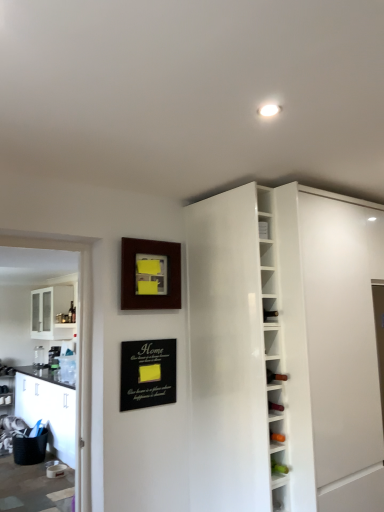
Locate an element on the screen. green matte bottle at lower right is located at coordinates (278, 467).

Measure the distance between point (132, 283) and camera.

A distance of 7.51 feet exists between point (132, 283) and camera.

The width and height of the screenshot is (384, 512). What do you see at coordinates (284, 349) in the screenshot? I see `white glossy cabinet at upper right` at bounding box center [284, 349].

Where is `green matte bottle at lower right`? Image resolution: width=384 pixels, height=512 pixels. green matte bottle at lower right is located at coordinates (278, 467).

Is green matte bottle at lower right to the right of black matte bulletin board at lower center from the viewer's perspective?

Yes.

Considering the positions of objects green matte bottle at lower right and black matte bulletin board at lower center in the image provided, who is behind, green matte bottle at lower right or black matte bulletin board at lower center?

black matte bulletin board at lower center is behind.

How much distance is there between green matte bottle at lower right and black matte bulletin board at lower center?

The distance of green matte bottle at lower right from black matte bulletin board at lower center is 29.48 inches.

Considering the relative sizes of green matte bottle at lower right and black matte bulletin board at lower center in the image provided, is green matte bottle at lower right wider than black matte bulletin board at lower center?

Indeed, green matte bottle at lower right has a greater width compared to black matte bulletin board at lower center.

Does black matte bulletin board at lower center lie in front of white glossy cabinet at upper right?

No.

Which object is positioned more to the right, black matte bulletin board at lower center or white glossy cabinet at upper right?

white glossy cabinet at upper right.

Based on the photo, in terms of size, does black matte bulletin board at lower center appear bigger or smaller than white glossy cabinet at upper right?

Clearly, black matte bulletin board at lower center is smaller in size than white glossy cabinet at upper right.

From the image's perspective, is black matte bulletin board at lower center positioned above or below white glossy cabinet at upper right?

Based on their image positions, black matte bulletin board at lower center is located above white glossy cabinet at upper right.

In the image, is black matte bulletin board at lower center positioned in front of or behind green matte bottle at lower right?

Clearly, black matte bulletin board at lower center is behind green matte bottle at lower right.

Is black matte bulletin board at lower center completely or partially outside of green matte bottle at lower right?

black matte bulletin board at lower center is positioned outside green matte bottle at lower right.

Is black matte bulletin board at lower center facing towards green matte bottle at lower right?

No.

Based on the photo, who is shorter, black matte bulletin board at lower center or green matte bottle at lower right?

green matte bottle at lower right is shorter.

Is wooden picture frame at upper center wider or thinner than green matte bottle at lower right?

Clearly, wooden picture frame at upper center has less width compared to green matte bottle at lower right.

Considering the relative positions of wooden picture frame at upper center and green matte bottle at lower right in the image provided, is wooden picture frame at upper center to the right of green matte bottle at lower right from the viewer's perspective?

In fact, wooden picture frame at upper center is to the left of green matte bottle at lower right.

Between wooden picture frame at upper center and green matte bottle at lower right, which one is positioned behind?

wooden picture frame at upper center is more distant.

Is wooden picture frame at upper center facing away from green matte bottle at lower right?

No, green matte bottle at lower right is not at the back of wooden picture frame at upper center.

Is point (282, 477) farther from viewer compared to point (214, 388)?

No, (282, 477) is in front of (214, 388).

Consider the image. From a real-world perspective, is green matte bottle at lower right physically located above or below white glossy cabinet at upper right?

Clearly, from a real-world perspective, green matte bottle at lower right is below white glossy cabinet at upper right.

Which object is closer to the camera taking this photo, green matte bottle at lower right or white glossy cabinet at upper right?

Positioned in front is white glossy cabinet at upper right.

Is green matte bottle at lower right looking in the opposite direction of white glossy cabinet at upper right?

No.

From the image's perspective, which is above, wooden picture frame at upper center or black matte bulletin board at lower center?

wooden picture frame at upper center.

From a real-world perspective, is wooden picture frame at upper center on black matte bulletin board at lower center?

Yes, from a real-world perspective, wooden picture frame at upper center is over black matte bulletin board at lower center

Considering the sizes of objects wooden picture frame at upper center and black matte bulletin board at lower center in the image provided, who is smaller, wooden picture frame at upper center or black matte bulletin board at lower center?

black matte bulletin board at lower center.

Does point (139, 301) appear closer or farther from the camera than point (137, 345)?

Point (139, 301).

Which object is further away from the camera, white glossy cabinet at upper right or wooden picture frame at upper center?

wooden picture frame at upper center is behind.

Are white glossy cabinet at upper right and wooden picture frame at upper center making contact?

No, white glossy cabinet at upper right is not touching wooden picture frame at upper center.

Between white glossy cabinet at upper right and wooden picture frame at upper center, which one has smaller size?

With smaller size is wooden picture frame at upper center.

Image resolution: width=384 pixels, height=512 pixels. I want to click on shelf to the right of black matte bulletin board at lower center, so click(x=278, y=467).

In the image, there is a black matte bulletin board at lower center. Where is `cabinetry below it (from a real-world perspective)`? cabinetry below it (from a real-world perspective) is located at coordinates (284, 349).

Which object lies nearer to the anchor point black matte bulletin board at lower center, green matte bottle at lower right or white glossy cabinet at upper right?

white glossy cabinet at upper right is closer to black matte bulletin board at lower center.

Which object lies further to the anchor point black matte bulletin board at lower center, green matte bottle at lower right or wooden picture frame at upper center?

green matte bottle at lower right lies further to black matte bulletin board at lower center than the other object.

Based on their spatial positions, is wooden picture frame at upper center or green matte bottle at lower right closer to white glossy cabinet at upper right?

wooden picture frame at upper center.

Estimate the real-world distances between objects in this image. Which object is closer to wooden picture frame at upper center, green matte bottle at lower right or black matte bulletin board at lower center?

The object closer to wooden picture frame at upper center is black matte bulletin board at lower center.

Looking at the image, which one is located further to black matte bulletin board at lower center, white glossy cabinet at upper right or green matte bottle at lower right?

green matte bottle at lower right.

Estimate the real-world distances between objects in this image. Which object is closer to green matte bottle at lower right, black matte bulletin board at lower center or white glossy cabinet at upper right?

The object closer to green matte bottle at lower right is white glossy cabinet at upper right.

Considering their positions, is green matte bottle at lower right positioned further to white glossy cabinet at upper right than black matte bulletin board at lower center?

The object further to white glossy cabinet at upper right is green matte bottle at lower right.

Which object lies nearer to the anchor point wooden picture frame at upper center, black matte bulletin board at lower center or green matte bottle at lower right?

black matte bulletin board at lower center is closer to wooden picture frame at upper center.

Image resolution: width=384 pixels, height=512 pixels. What are the coordinates of `shelf between wooden picture frame at upper center and white glossy cabinet at upper right in the horizontal direction` in the screenshot? It's located at (278, 467).

Where is `shelf situated between black matte bulletin board at lower center and white glossy cabinet at upper right from left to right`? This screenshot has height=512, width=384. shelf situated between black matte bulletin board at lower center and white glossy cabinet at upper right from left to right is located at coordinates (278, 467).

Locate an element on the screen. This screenshot has width=384, height=512. bulletin board between wooden picture frame at upper center and white glossy cabinet at upper right in the horizontal direction is located at coordinates (147, 373).

This screenshot has height=512, width=384. Find the location of `bulletin board between wooden picture frame at upper center and green matte bottle at lower right in the vertical direction`. bulletin board between wooden picture frame at upper center and green matte bottle at lower right in the vertical direction is located at coordinates (147, 373).